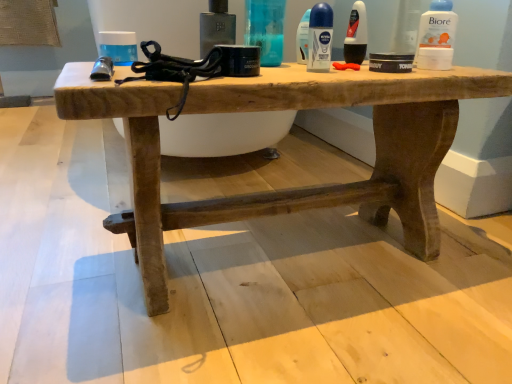
Locate an element on the screen. free point behind rustic wood table at center is located at coordinates 249,171.